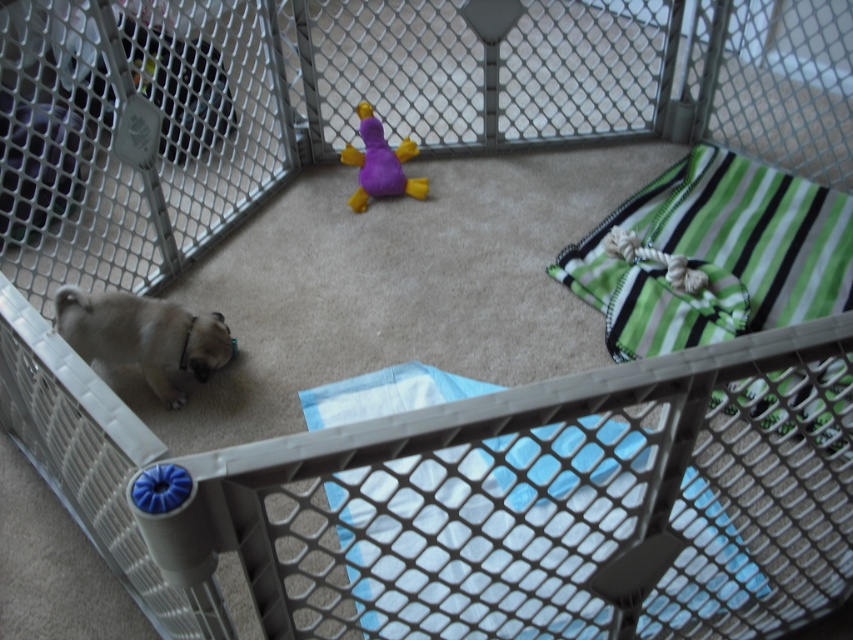
Can you confirm if fuzzy beige dog at bottom left is bigger than purple plush duck at center?

Yes.

Between point (173, 323) and point (376, 129), which one is positioned in front?

Point (173, 323) is in front.

Image resolution: width=853 pixels, height=640 pixels. What are the coordinates of `fuzzy beige dog at bottom left` in the screenshot? It's located at point(143,337).